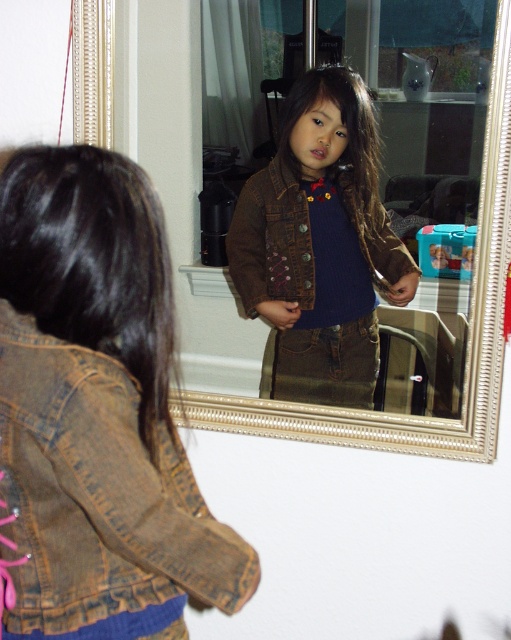
You are a GUI agent. You are given a task and a screenshot of the screen. Output one action in this format:
    pyautogui.click(x=<x>, y=<y>)
    Task: Click on the denim jacket at lower left
    This screenshot has height=640, width=511.
    Given the screenshot: What is the action you would take?
    pyautogui.click(x=97, y=410)

Which is in front, point (96, 394) or point (284, 276)?

Point (96, 394) is more forward.

Image resolution: width=511 pixels, height=640 pixels. I want to click on denim jacket at lower left, so click(97, 410).

Which is more to the right, denim jacket at lower left or brushed metal mirror at center?

brushed metal mirror at center is more to the right.

Is the position of denim jacket at lower left less distant than that of brushed metal mirror at center?

Yes, denim jacket at lower left is in front of brushed metal mirror at center.

Find the location of `denim jacket at lower left`. denim jacket at lower left is located at coordinates (97, 410).

Identify the location of denim jacket at lower left. The height and width of the screenshot is (640, 511). (97, 410).

Is brown denim jacket at center closer to the viewer compared to brushed metal mirror at center?

Yes, brown denim jacket at center is closer to the viewer.

Which is above, brown denim jacket at center or brushed metal mirror at center?

brown denim jacket at center is higher up.

Who is more distant from viewer, (243, 211) or (430, 403)?

Positioned behind is point (243, 211).

I want to click on brown denim jacket at center, so click(319, 243).